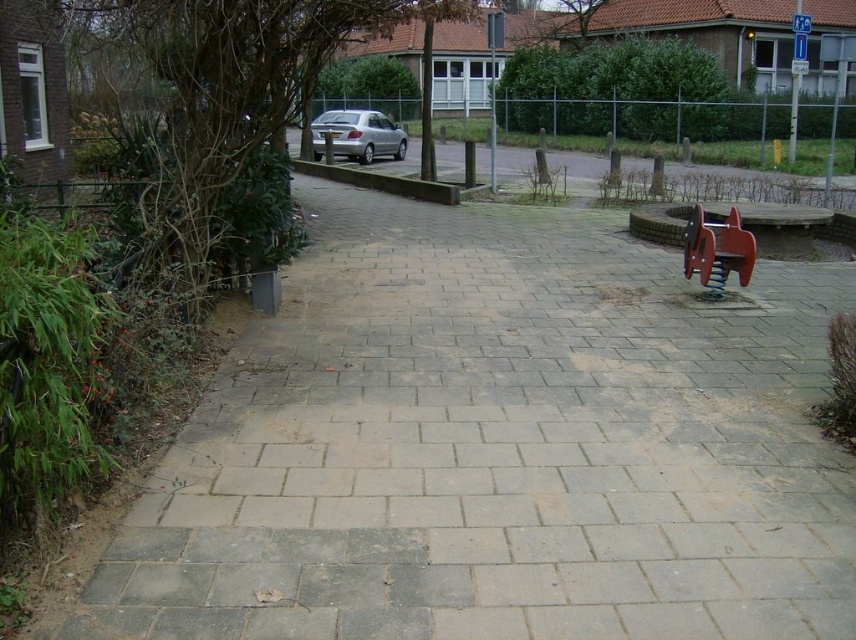
Question: Can you confirm if metallic red swing set at right is positioned below silver metallic car at center?

Choices:
 (A) yes
 (B) no

Answer: (A)

Question: Can you confirm if gray concrete pavement at left is bigger than silver metallic car at center?

Choices:
 (A) no
 (B) yes

Answer: (A)

Question: Which of the following is the farthest from the observer?

Choices:
 (A) (235, 371)
 (B) (324, 129)
 (C) (717, 260)

Answer: (B)

Question: Which point is closer to the camera?

Choices:
 (A) (169, 588)
 (B) (708, 292)
 (C) (360, 115)

Answer: (A)

Question: Which is nearer to the gray concrete pavement at left?

Choices:
 (A) metallic red swing set at right
 (B) silver metallic car at center

Answer: (A)

Question: Does gray concrete pavement at left appear on the right side of metallic red swing set at right?

Choices:
 (A) yes
 (B) no

Answer: (B)